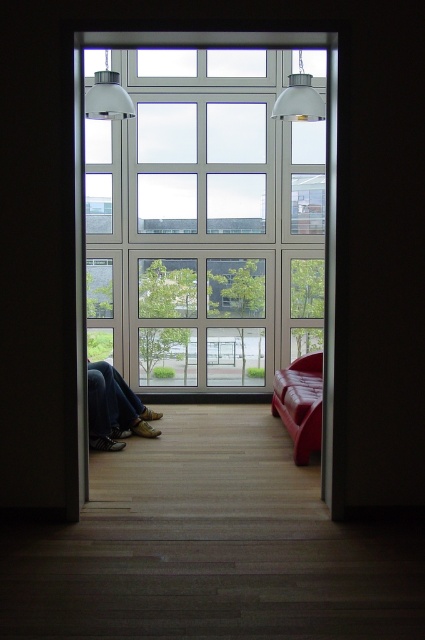
You are standing in the doorway looking into the room. You see the clear glass window at center and the leather shoes at lower left. Which object is closer to you?

The leather shoes at lower left are closer to you because they are behind the clear glass window at center, meaning the window is between you and the shoes.

You are a delivery person carrying a large package that needs to be placed on the floor. You see the clear glass window at center and the leather couch at right. Which object is closer to the floor?

The leather couch at right is closer to the floor because the clear glass window at center is above it.

You are standing in the doorway and want to place a small potted plant exactly at the point marked by the coordinates point (204,221). Will the plant be placed on the clear glass window at center?

Yes, the point (204,221) is on the clear glass window at center, so placing the plant there would put it directly on the window.